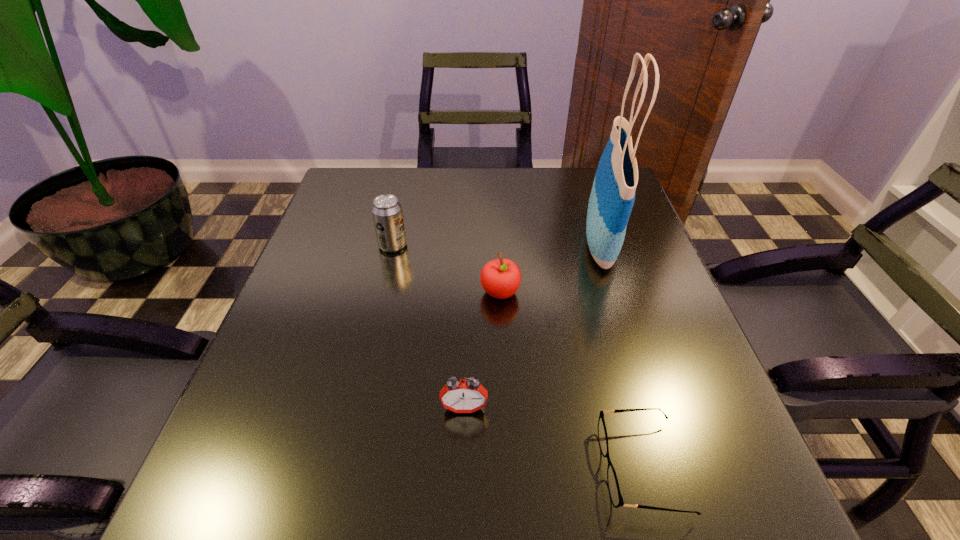
Identify the location of free area in between the beer can and the apple. (446, 269).

Where is `free space between the alarm clock and the tote bag`? The width and height of the screenshot is (960, 540). free space between the alarm clock and the tote bag is located at coordinates (533, 325).

Where is `free space between the nearest object and the alarm clock`? free space between the nearest object and the alarm clock is located at coordinates (553, 438).

Identify the location of empty space that is in between the alarm clock and the apple. The height and width of the screenshot is (540, 960). (482, 350).

Point out which object is positioned as the nearest to the apple. Please provide its 2D coordinates. Your answer should be formatted as a tuple, i.e. [(x, y)], where the tuple contains the x and y coordinates of a point satisfying the conditions above.

[(612, 197)]

Select which object appears as the third closest to the spectacles. Please provide its 2D coordinates. Your answer should be formatted as a tuple, i.e. [(x, y)], where the tuple contains the x and y coordinates of a point satisfying the conditions above.

[(612, 197)]

Locate an element on the screen. The height and width of the screenshot is (540, 960). vacant position in the image that satisfies the following two spatial constraints: 1. on the front side of the beer can; 2. on the right side of the apple is located at coordinates (382, 292).